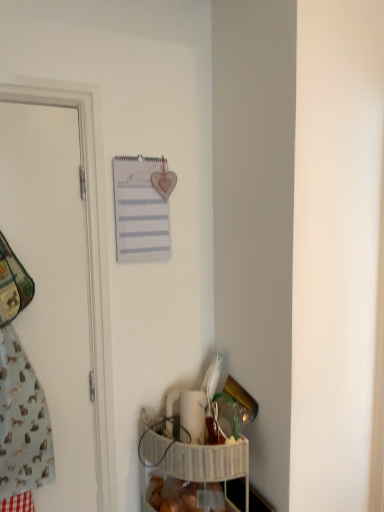
Measure the distance between light blue fabric at left and camera.

The distance of light blue fabric at left from camera is 4.39 feet.

Consider the image. Measure the distance between white matte door at left and camera.

4.40 feet.

Describe the element at coordinates (47, 312) in the screenshot. The width and height of the screenshot is (384, 512). I see `white matte door at left` at that location.

The width and height of the screenshot is (384, 512). Find the location of `white woven basket at lower right`. white woven basket at lower right is located at coordinates [190, 455].

This screenshot has height=512, width=384. What do you see at coordinates (190, 455) in the screenshot?
I see `white woven basket at lower right` at bounding box center [190, 455].

I want to click on light blue fabric at left, so click(20, 398).

Consider the image. From a real-world perspective, who is located higher, light blue fabric at left or white matte door at left?

From a 3D spatial view, white matte door at left is above.

Does point (22, 479) come in front of point (1, 474)?

No.

From the image's perspective, between light blue fabric at left and white matte door at left, which one is located above?

From the image's view, white matte door at left is above.

Considering the sizes of objects translucent plastic bag of bread at lower center and white paper journal at upper center in the image provided, who is shorter, translucent plastic bag of bread at lower center or white paper journal at upper center?

translucent plastic bag of bread at lower center.

Does point (158, 486) lie in front of point (121, 207)?

No, (158, 486) is behind (121, 207).

Looking at the image, does translucent plastic bag of bread at lower center seem bigger or smaller compared to white paper journal at upper center?

Clearly, translucent plastic bag of bread at lower center is larger in size than white paper journal at upper center.

From a real-world perspective, between translucent plastic bag of bread at lower center and white matte door at left, who is vertically higher?

From a 3D spatial view, white matte door at left is above.

Can you confirm if translucent plastic bag of bread at lower center is taller than white matte door at left?

No.

Is point (189, 483) positioned in front of point (9, 139)?

That is False.

Is white woven basket at lower right taller than translucent plastic bag of bread at lower center?

Yes.

Considering the positions of objects white woven basket at lower right and translucent plastic bag of bread at lower center in the image provided, who is more to the left, white woven basket at lower right or translucent plastic bag of bread at lower center?

From the viewer's perspective, translucent plastic bag of bread at lower center appears more on the left side.

From a real-world perspective, relative to translucent plastic bag of bread at lower center, is white woven basket at lower right vertically above or below?

white woven basket at lower right is situated higher than translucent plastic bag of bread at lower center in the real world.

Is white woven basket at lower right closer to the viewer compared to translucent plastic bag of bread at lower center?

Yes, it is.

Is light blue fabric at left closer to camera compared to translucent plastic bag of bread at lower center?

Yes, it is in front of translucent plastic bag of bread at lower center.

Which object is wider, light blue fabric at left or translucent plastic bag of bread at lower center?

translucent plastic bag of bread at lower center.

Considering the relative positions of light blue fabric at left and translucent plastic bag of bread at lower center in the image provided, is light blue fabric at left to the left or to the right of translucent plastic bag of bread at lower center?

In the image, light blue fabric at left appears on the left side of translucent plastic bag of bread at lower center.

Are light blue fabric at left and translucent plastic bag of bread at lower center located far from each other?

They are positioned close to each other.

From a real-world perspective, who is located lower, white matte door at left or translucent plastic bag of bread at lower center?

In real-world perspective, translucent plastic bag of bread at lower center is lower.

Is white matte door at left far from translucent plastic bag of bread at lower center?

No, there isn't a large distance between white matte door at left and translucent plastic bag of bread at lower center.

Considering the relative sizes of white matte door at left and translucent plastic bag of bread at lower center in the image provided, is white matte door at left thinner than translucent plastic bag of bread at lower center?

Correct, the width of white matte door at left is less than that of translucent plastic bag of bread at lower center.

Locate an element on the screen. The height and width of the screenshot is (512, 384). food on the right of white matte door at left is located at coordinates (186, 496).

Consider the image. Does white woven basket at lower right have a lesser height compared to white matte door at left?

Correct, white woven basket at lower right is not as tall as white matte door at left.

Can you confirm if white woven basket at lower right is wider than white matte door at left?

Yes.

Based on the photo, is white woven basket at lower right not near white matte door at left?

No, white woven basket at lower right is not far from white matte door at left.

Does point (168, 438) appear closer or farther from the camera than point (54, 170)?

Point (168, 438).

I want to click on laundry directly beneath the white matte door at left (from a real-world perspective), so click(x=20, y=398).

In order to click on journal above the translucent plastic bag of bread at lower center (from the image's perspective) in this screenshot , I will do `click(140, 211)`.

Based on their spatial positions, is translucent plastic bag of bread at lower center or white woven basket at lower right closer to white matte door at left?

Based on the image, white woven basket at lower right appears to be nearer to white matte door at left.

Estimate the real-world distances between objects in this image. Which object is closer to white woven basket at lower right, translucent plastic bag of bread at lower center or white paper journal at upper center?

Among the two, translucent plastic bag of bread at lower center is located nearer to white woven basket at lower right.

Consider the image. From the image, which object appears to be nearer to light blue fabric at left, white woven basket at lower right or white paper journal at upper center?

white woven basket at lower right is positioned closer to the anchor light blue fabric at left.

When comparing their distances from white woven basket at lower right, does white matte door at left or white paper journal at upper center seem further?

white paper journal at upper center is positioned further to the anchor white woven basket at lower right.

Based on the photo, considering their positions, is translucent plastic bag of bread at lower center positioned further to white paper journal at upper center than white matte door at left?

The object further to white paper journal at upper center is translucent plastic bag of bread at lower center.

Which object lies further to the anchor point white woven basket at lower right, white matte door at left or light blue fabric at left?

Among the two, light blue fabric at left is located further to white woven basket at lower right.

Considering their positions, is white woven basket at lower right positioned further to light blue fabric at left than white matte door at left?

Based on the image, white woven basket at lower right appears to be further to light blue fabric at left.

Considering their positions, is light blue fabric at left positioned closer to white paper journal at upper center than white woven basket at lower right?

light blue fabric at left.

Where is `laundry that lies between white paper journal at upper center and translucent plastic bag of bread at lower center from top to bottom`? The image size is (384, 512). laundry that lies between white paper journal at upper center and translucent plastic bag of bread at lower center from top to bottom is located at coordinates pyautogui.click(x=20, y=398).

This screenshot has height=512, width=384. I want to click on basket between light blue fabric at left and translucent plastic bag of bread at lower center in the vertical direction, so click(x=190, y=455).

This screenshot has height=512, width=384. I want to click on laundry between white matte door at left and white woven basket at lower right in the up-down direction, so click(20, 398).

At what (x,y) coordinates should I click in order to perform the action: click on door that lies between white paper journal at upper center and translucent plastic bag of bread at lower center from top to bottom. Please return your answer as a coordinate pair (x, y). The height and width of the screenshot is (512, 384). Looking at the image, I should click on (47, 312).